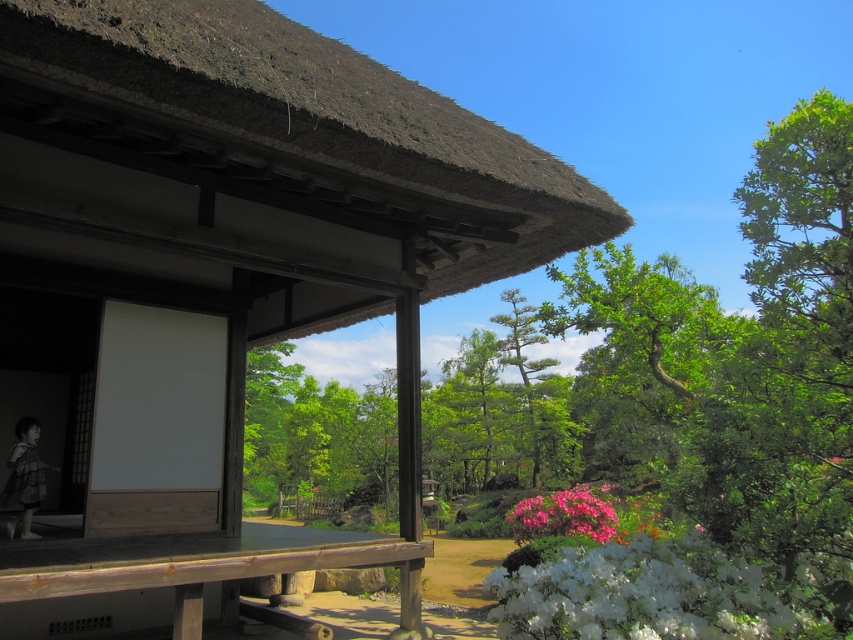
Is thatched roof hut at center thinner than green leafy tree at center?

Indeed, thatched roof hut at center has a lesser width compared to green leafy tree at center.

This screenshot has height=640, width=853. Describe the element at coordinates (222, 278) in the screenshot. I see `thatched roof hut at center` at that location.

Locate an element on the screen. The height and width of the screenshot is (640, 853). thatched roof hut at center is located at coordinates (222, 278).

Who is lower down, thatched roof hut at center or pink matte flower at lower right?

pink matte flower at lower right

Is thatched roof hut at center to the right of pink matte flower at lower right from the viewer's perspective?

In fact, thatched roof hut at center is to the left of pink matte flower at lower right.

Which is behind, point (317, 545) or point (512, 531)?

Point (512, 531)

What are the coordinates of `thatched roof hut at center` in the screenshot? It's located at (222, 278).

Can you confirm if thatched roof hut at center is smaller than wooden picnic table at center?

Yes.

Locate an element on the screen. thatched roof hut at center is located at coordinates (222, 278).

Where is `thatched roof hut at center`? thatched roof hut at center is located at coordinates (222, 278).